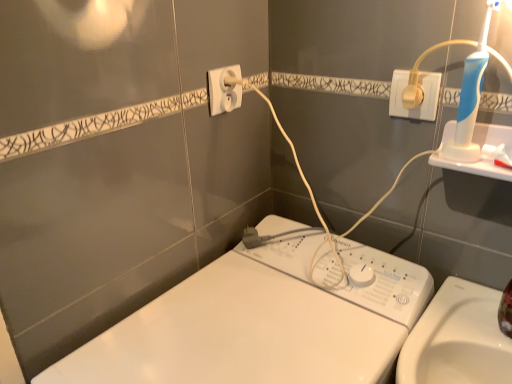
What do you see at coordinates (418, 102) in the screenshot? I see `white plastic plug at upper right, which is the 2th power plugs and sockets in left-to-right order` at bounding box center [418, 102].

Looking at this image, how much space does white plastic plug at upper right, which is the 2th power plugs and sockets in left-to-right order, occupy horizontally?

white plastic plug at upper right, which is the 2th power plugs and sockets in left-to-right order, is 0.73 inches wide.

What are the coordinates of `white plastic socket at upper center, marked as the 2th power plugs and sockets in a right-to-left arrangement` in the screenshot? It's located at (224, 89).

Which object is closer to the camera taking this photo, white plastic washing machine at center or white plastic socket at upper center, the 1th power plugs and sockets positioned from the left?

Positioned in front is white plastic washing machine at center.

Considering the relative sizes of white plastic washing machine at center and white plastic socket at upper center, the 1th power plugs and sockets positioned from the left, in the image provided, is white plastic washing machine at center shorter than white plastic socket at upper center, the 1th power plugs and sockets positioned from the left,?

In fact, white plastic washing machine at center may be taller than white plastic socket at upper center, the 1th power plugs and sockets positioned from the left.

Which of these two, white plastic washing machine at center or white plastic socket at upper center, the 1th power plugs and sockets positioned from the left, is smaller?

Smaller between the two is white plastic socket at upper center, the 1th power plugs and sockets positioned from the left.

From the image's perspective, which one is positioned lower, white plastic plug at upper right, arranged as the first power plugs and sockets when viewed from the right, or white plastic washing machine at center?

white plastic washing machine at center, from the image's perspective.

Is point (428, 85) closer to viewer compared to point (221, 266)?

Yes, point (428, 85) is closer to viewer.

From a real-world perspective, is white plastic plug at upper right, arranged as the first power plugs and sockets when viewed from the right, positioned over white plastic washing machine at center based on gravity?

Indeed, from a real-world perspective, white plastic plug at upper right, arranged as the first power plugs and sockets when viewed from the right, stands above white plastic washing machine at center.

Is white plastic plug at upper right, arranged as the first power plugs and sockets when viewed from the right, further to the viewer compared to white plastic washing machine at center?

Yes, white plastic plug at upper right, arranged as the first power plugs and sockets when viewed from the right, is further from the viewer.

Is white plastic socket at upper center, marked as the 2th power plugs and sockets in a right-to-left arrangement, aimed at white plastic plug at upper right, arranged as the first power plugs and sockets when viewed from the right?

Yes.

Is white plastic plug at upper right, which is the 2th power plugs and sockets in left-to-right order, surrounded by white plastic socket at upper center, marked as the 2th power plugs and sockets in a right-to-left arrangement?

No, white plastic plug at upper right, which is the 2th power plugs and sockets in left-to-right order, is not surrounded by white plastic socket at upper center, marked as the 2th power plugs and sockets in a right-to-left arrangement.

Between point (225, 99) and point (403, 113), which one is positioned in front?

The point (403, 113) is more forward.

Is white plastic socket at upper center, the 1th power plugs and sockets positioned from the left, bigger than white plastic plug at upper right, arranged as the first power plugs and sockets when viewed from the right?

Yes, white plastic socket at upper center, the 1th power plugs and sockets positioned from the left, is bigger than white plastic plug at upper right, arranged as the first power plugs and sockets when viewed from the right.

Could you tell me if white plastic socket at upper center, marked as the 2th power plugs and sockets in a right-to-left arrangement, is turned towards white plastic washing machine at center?

No.

Relative to white plastic washing machine at center, is white plastic socket at upper center, marked as the 2th power plugs and sockets in a right-to-left arrangement, in front or behind?

white plastic socket at upper center, marked as the 2th power plugs and sockets in a right-to-left arrangement, is behind white plastic washing machine at center.

From the image's perspective, who appears lower, white plastic socket at upper center, marked as the 2th power plugs and sockets in a right-to-left arrangement, or white plastic washing machine at center?

white plastic washing machine at center is shown below in the image.

Measure the distance from white plastic washing machine at center to white plastic plug at upper right, which is the 2th power plugs and sockets in left-to-right order.

white plastic washing machine at center and white plastic plug at upper right, which is the 2th power plugs and sockets in left-to-right order, are 16.71 inches apart.

From the image's perspective, is white plastic washing machine at center located above white plastic plug at upper right, which is the 2th power plugs and sockets in left-to-right order?

Incorrect, from the image's perspective, white plastic washing machine at center is lower than white plastic plug at upper right, which is the 2th power plugs and sockets in left-to-right order.

Considering their positions, is white plastic washing machine at center located in front of or behind white plastic plug at upper right, which is the 2th power plugs and sockets in left-to-right order?

In the image, white plastic washing machine at center appears in front of white plastic plug at upper right, which is the 2th power plugs and sockets in left-to-right order.

Considering the positions of objects white plastic washing machine at center and white plastic plug at upper right, arranged as the first power plugs and sockets when viewed from the right, in the image provided, who is more to the left, white plastic washing machine at center or white plastic plug at upper right, arranged as the first power plugs and sockets when viewed from the right,?

Positioned to the left is white plastic washing machine at center.

Relative to white plastic socket at upper center, the 1th power plugs and sockets positioned from the left, is white plastic plug at upper right, arranged as the first power plugs and sockets when viewed from the right, in front or behind?

Clearly, white plastic plug at upper right, arranged as the first power plugs and sockets when viewed from the right, is in front of white plastic socket at upper center, the 1th power plugs and sockets positioned from the left.

Can white plastic socket at upper center, marked as the 2th power plugs and sockets in a right-to-left arrangement, be found inside white plastic plug at upper right, arranged as the first power plugs and sockets when viewed from the right?

That's incorrect, white plastic socket at upper center, marked as the 2th power plugs and sockets in a right-to-left arrangement, is not inside white plastic plug at upper right, arranged as the first power plugs and sockets when viewed from the right.

Is point (396, 90) farther from camera compared to point (236, 78)?

No, (396, 90) is in front of (236, 78).

Looking at this image, is white plastic plug at upper right, arranged as the first power plugs and sockets when viewed from the right, far from white plastic socket at upper center, the 1th power plugs and sockets positioned from the left?

No, there isn't a large distance between white plastic plug at upper right, arranged as the first power plugs and sockets when viewed from the right, and white plastic socket at upper center, the 1th power plugs and sockets positioned from the left.

Locate an element on the screen. machine located below the white plastic socket at upper center, marked as the 2th power plugs and sockets in a right-to-left arrangement (from the image's perspective) is located at coordinates (263, 322).

Locate an element on the screen. the 1st power plugs and sockets above the white plastic washing machine at center (from the image's perspective) is located at coordinates (418, 102).

Looking at the image, which one is located closer to white plastic socket at upper center, marked as the 2th power plugs and sockets in a right-to-left arrangement, white plastic plug at upper right, which is the 2th power plugs and sockets in left-to-right order, or white plastic washing machine at center?

white plastic plug at upper right, which is the 2th power plugs and sockets in left-to-right order, is positioned closer to the anchor white plastic socket at upper center, marked as the 2th power plugs and sockets in a right-to-left arrangement.

When comparing their distances from white plastic washing machine at center, does white plastic socket at upper center, the 1th power plugs and sockets positioned from the left, or white plastic plug at upper right, which is the 2th power plugs and sockets in left-to-right order, seem closer?

white plastic socket at upper center, the 1th power plugs and sockets positioned from the left, lies closer to white plastic washing machine at center than the other object.

Which object lies nearer to the anchor point white plastic plug at upper right, which is the 2th power plugs and sockets in left-to-right order, white plastic socket at upper center, marked as the 2th power plugs and sockets in a right-to-left arrangement, or white plastic washing machine at center?

The object closer to white plastic plug at upper right, which is the 2th power plugs and sockets in left-to-right order, is white plastic socket at upper center, marked as the 2th power plugs and sockets in a right-to-left arrangement.

Based on the photo, which object lies nearer to the anchor point white plastic plug at upper right, which is the 2th power plugs and sockets in left-to-right order, white plastic washing machine at center or white plastic socket at upper center, marked as the 2th power plugs and sockets in a right-to-left arrangement?

white plastic socket at upper center, marked as the 2th power plugs and sockets in a right-to-left arrangement, is closer to white plastic plug at upper right, which is the 2th power plugs and sockets in left-to-right order.

Looking at the image, which one is located further to white plastic washing machine at center, white plastic plug at upper right, which is the 2th power plugs and sockets in left-to-right order, or white plastic socket at upper center, marked as the 2th power plugs and sockets in a right-to-left arrangement?

Among the two, white plastic plug at upper right, which is the 2th power plugs and sockets in left-to-right order, is located further to white plastic washing machine at center.

Which object lies further to the anchor point white plastic socket at upper center, the 1th power plugs and sockets positioned from the left, white plastic washing machine at center or white plastic plug at upper right, which is the 2th power plugs and sockets in left-to-right order?

Based on the image, white plastic washing machine at center appears to be further to white plastic socket at upper center, the 1th power plugs and sockets positioned from the left.

The height and width of the screenshot is (384, 512). What are the coordinates of `power plugs and sockets between white plastic socket at upper center, the 1th power plugs and sockets positioned from the left, and white plastic washing machine at center in the up-down direction` in the screenshot? It's located at (418, 102).